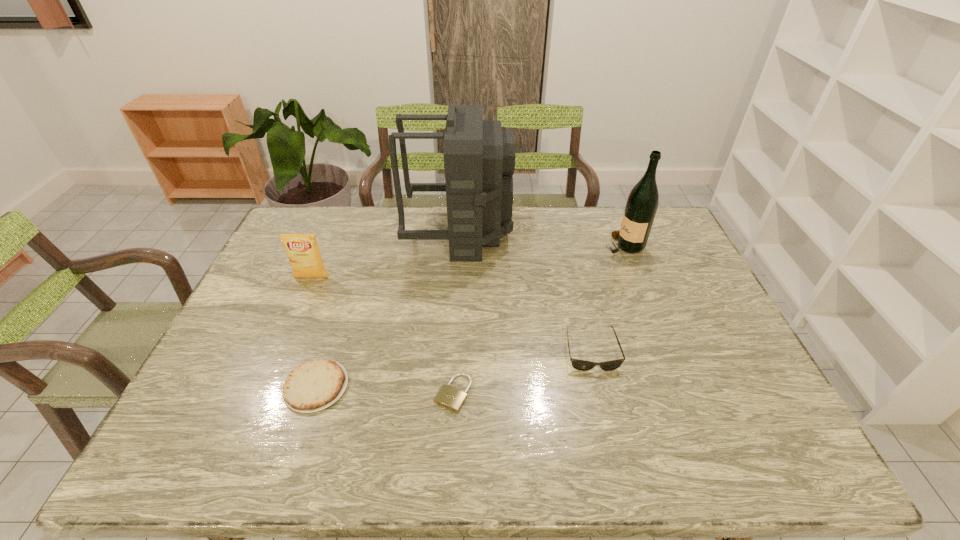
The image size is (960, 540). In order to click on backpack in this screenshot , I will do `click(479, 157)`.

Image resolution: width=960 pixels, height=540 pixels. I want to click on the second tallest object, so click(642, 203).

The width and height of the screenshot is (960, 540). Identify the location of the rightmost object. (642, 203).

Image resolution: width=960 pixels, height=540 pixels. I want to click on crisp (potato chip), so click(x=303, y=252).

At what (x,y) coordinates should I click in order to perform the action: click on the fourth nearest object. Please return your answer as a coordinate pair (x, y). Looking at the image, I should click on (303, 252).

At what (x,y) coordinates should I click in order to perform the action: click on sunglasses. Please return your answer as a coordinate pair (x, y). This screenshot has height=540, width=960. Looking at the image, I should click on (582, 365).

I want to click on the fourth tallest object, so click(582, 365).

At what (x,y) coordinates should I click in order to perform the action: click on the fifth tallest object. Please return your answer as a coordinate pair (x, y). This screenshot has height=540, width=960. Looking at the image, I should click on (315, 385).

You are a GUI agent. You are given a task and a screenshot of the screen. Output one action in this format:
    pyautogui.click(x=<x>, y=<y>)
    Task: Click on the shortest object
    The image size is (960, 540).
    Given the screenshot: What is the action you would take?
    pyautogui.click(x=451, y=398)

Locate an element on the screen. Image resolution: width=960 pixels, height=540 pixels. blank space located 0.360m on the front compartment of the backpack is located at coordinates (611, 233).